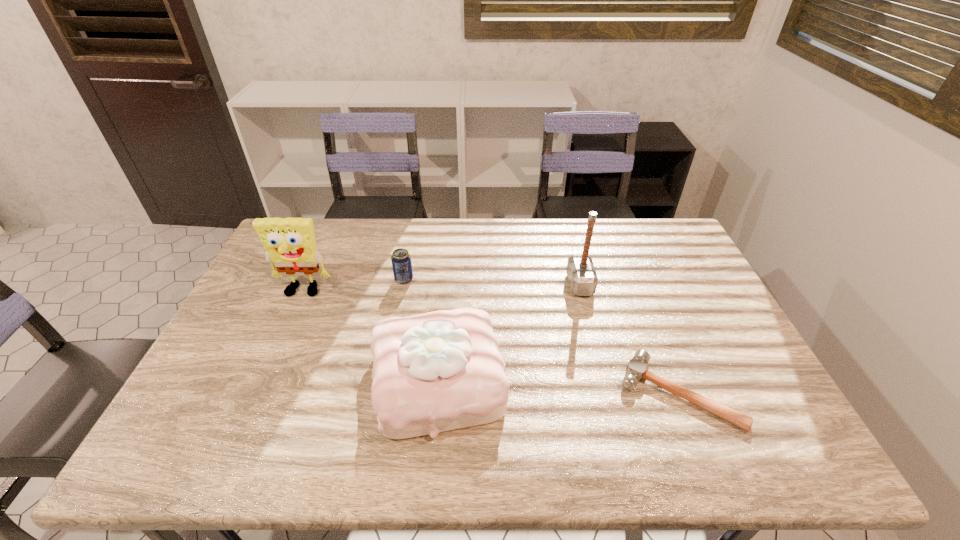
In order to click on free spot at the near edge of the desktop in this screenshot , I will do `click(534, 430)`.

I want to click on vacant space at the left edge of the desktop, so click(266, 260).

This screenshot has width=960, height=540. What are the coordinates of `free space at the right edge` in the screenshot? It's located at (688, 299).

Find the location of a particular element. This screenshot has width=960, height=540. free space at the far right corner of the desktop is located at coordinates (643, 218).

This screenshot has width=960, height=540. I want to click on vacant space in between the leftmost object and the third tallest object, so click(x=371, y=336).

Locate an element on the screen. free space between the cake and the taller hammer is located at coordinates (509, 332).

What are the coordinates of `vacant space in between the farther hammer and the second shortest object` in the screenshot? It's located at (492, 282).

The width and height of the screenshot is (960, 540). What are the coordinates of `vacant space that is in between the nearer hammer and the third tallest object` in the screenshot? It's located at (559, 386).

Where is `free point between the taller hammer and the cake`? Image resolution: width=960 pixels, height=540 pixels. free point between the taller hammer and the cake is located at coordinates (509, 332).

Image resolution: width=960 pixels, height=540 pixels. Find the location of `vacant area between the soda and the nearer hammer`. vacant area between the soda and the nearer hammer is located at coordinates (541, 336).